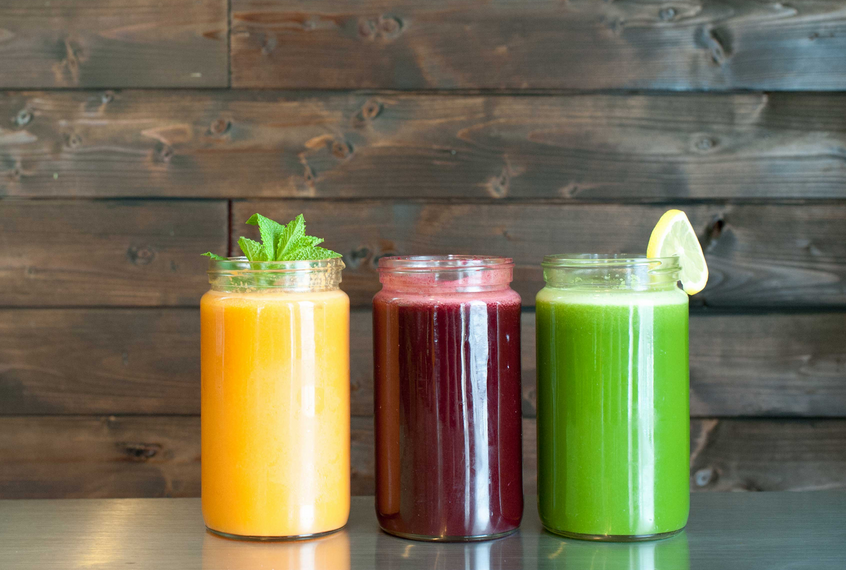
At what (x,y) coordinates should I click in order to perform the action: click on wall. Please return your answer as a coordinate pair (x, y). The height and width of the screenshot is (570, 846). Looking at the image, I should click on (577, 125), (114, 300).